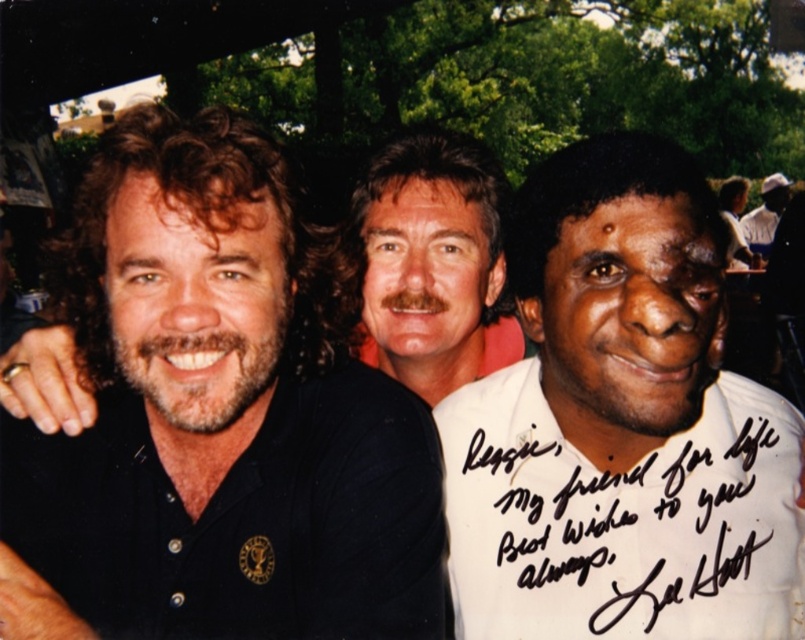
How far apart are white paper at right and brown hair at center?

white paper at right and brown hair at center are 17.28 inches apart from each other.

Does white paper at right appear under brown hair at center?

Correct, white paper at right is located below brown hair at center.

Does point (490, 547) come farther from viewer compared to point (436, 296)?

No, it is in front of (436, 296).

Identify the location of white paper at right. The image size is (805, 640). (622, 531).

Can you confirm if brown hair at center is shorter than white cotton shirt at upper right?

Yes.

Is brown hair at center positioned at the back of white cotton shirt at upper right?

No, it is in front of white cotton shirt at upper right.

Who is more forward, (362, 211) or (742, 227)?

Point (362, 211) is in front.

Locate an element on the screen. brown hair at center is located at coordinates (432, 262).

Is black cotton polo shirt at left above white cotton shirt at upper right?

No, black cotton polo shirt at left is not above white cotton shirt at upper right.

Is black cotton polo shirt at left shorter than white cotton shirt at upper right?

Correct, black cotton polo shirt at left is not as tall as white cotton shirt at upper right.

This screenshot has width=805, height=640. I want to click on black cotton polo shirt at left, so click(215, 420).

Where is `black cotton polo shirt at left`? The width and height of the screenshot is (805, 640). black cotton polo shirt at left is located at coordinates (215, 420).